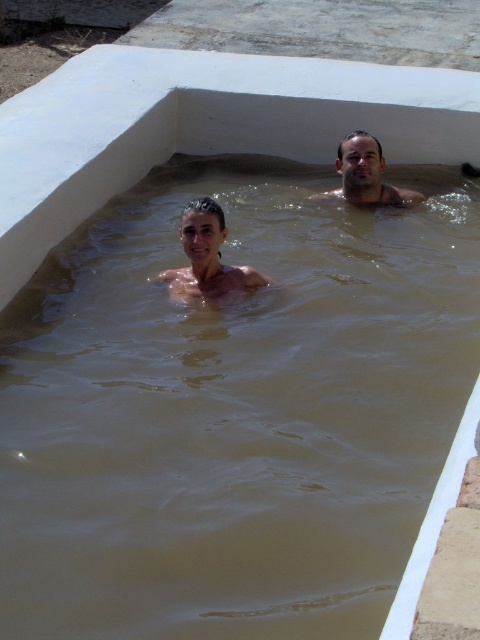
Question: Can you confirm if smooth skin woman at center is positioned above brown skin man at upper right?

Choices:
 (A) yes
 (B) no

Answer: (B)

Question: Among these points, which one is nearest to the camera?

Choices:
 (A) (172, 285)
 (B) (392, 189)

Answer: (A)

Question: In this image, where is smooth skin woman at center located relative to brown skin man at upper right?

Choices:
 (A) left
 (B) right

Answer: (A)

Question: Does smooth skin woman at center have a lesser width compared to brown skin man at upper right?

Choices:
 (A) no
 (B) yes

Answer: (B)